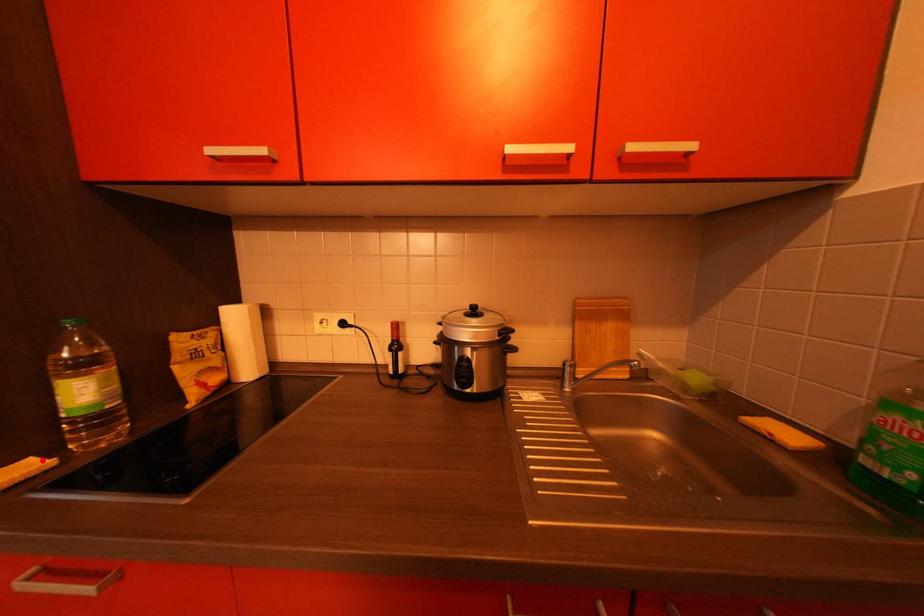
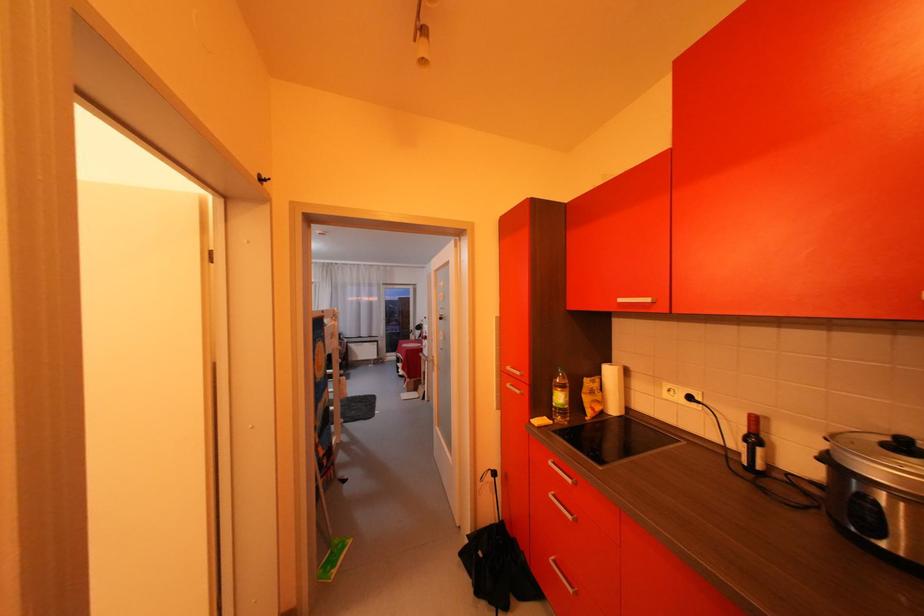
Question: I am providing you with two images of the same scene from different viewpoints. Given a red point in image1, look at the same physical point in image2. Is it:

Choices:
 (A) Closer to the viewpoint
 (B) Farther from the viewpoint

Answer: (B)